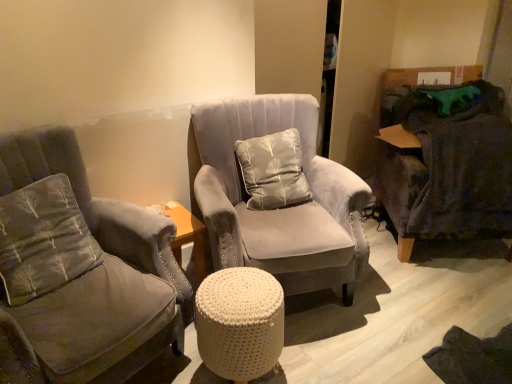
Question: Is dark gray fabric swivel chair at right looking in the opposite direction of gray fabric pillow at left, placed as the 2th pillow when sorted from back to front?

Choices:
 (A) yes
 (B) no

Answer: (B)

Question: Does dark gray fabric swivel chair at right come behind gray fabric pillow at left, placed as the 2th pillow when sorted from back to front?

Choices:
 (A) no
 (B) yes

Answer: (B)

Question: Is the surface of dark gray fabric swivel chair at right in direct contact with gray fabric pillow at left, placed as the 2th pillow when sorted from back to front?

Choices:
 (A) no
 (B) yes

Answer: (A)

Question: From the image's perspective, is dark gray fabric swivel chair at right beneath gray fabric pillow at left, placed as the 2th pillow when sorted from back to front?

Choices:
 (A) yes
 (B) no

Answer: (B)

Question: From a real-world perspective, is dark gray fabric swivel chair at right on gray fabric pillow at left, the first pillow viewed from the left?

Choices:
 (A) no
 (B) yes

Answer: (A)

Question: Is dark gray fabric swivel chair at right located outside gray fabric pillow at left, which is the 2th pillow in right-to-left order?

Choices:
 (A) no
 (B) yes

Answer: (B)

Question: Is gray fabric pillow at left, placed as the 2th pillow when sorted from back to front, completely or partially outside of light gray fabric pillow at center, which is the 2th pillow from left to right?

Choices:
 (A) yes
 (B) no

Answer: (A)

Question: Is gray fabric pillow at left, which is the 2th pillow in right-to-left order, further to the viewer compared to light gray fabric pillow at center, arranged as the second pillow when viewed from the front?

Choices:
 (A) no
 (B) yes

Answer: (A)

Question: Is gray fabric pillow at left, the first pillow viewed from the left, facing away from light gray fabric pillow at center, which is the first pillow from back to front?

Choices:
 (A) no
 (B) yes

Answer: (A)

Question: Considering the relative sizes of gray fabric pillow at left, placed as the 2th pillow when sorted from back to front, and light gray fabric pillow at center, which is the first pillow from back to front, in the image provided, is gray fabric pillow at left, placed as the 2th pillow when sorted from back to front, bigger than light gray fabric pillow at center, which is the first pillow from back to front,?

Choices:
 (A) no
 (B) yes

Answer: (A)

Question: Is gray fabric pillow at left, the 1th pillow positioned from the front, facing towards light gray fabric pillow at center, which is the 2th pillow from left to right?

Choices:
 (A) yes
 (B) no

Answer: (B)

Question: From a real-world perspective, does gray fabric pillow at left, which is the 2th pillow in right-to-left order, stand above light gray fabric pillow at center, which ranks as the first pillow in right-to-left order?

Choices:
 (A) yes
 (B) no

Answer: (B)

Question: Is there a large distance between dark gray fabric swivel chair at right and velvet gray armchair at left, arranged as the 2th chair when viewed from the right?

Choices:
 (A) no
 (B) yes

Answer: (B)